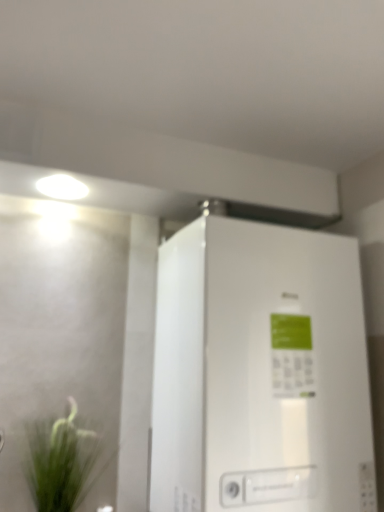
Question: From a real-world perspective, is green grass at lower left physically located above or below white glossy refrigerator at center?

Choices:
 (A) below
 (B) above

Answer: (A)

Question: Looking at the image, does green grass at lower left seem bigger or smaller compared to white glossy refrigerator at center?

Choices:
 (A) small
 (B) big

Answer: (A)

Question: In the image, is green grass at lower left positioned in front of or behind white glossy refrigerator at center?

Choices:
 (A) front
 (B) behind

Answer: (B)

Question: Is point [334, 416] positioned closer to the camera than point [36, 499]?

Choices:
 (A) farther
 (B) closer

Answer: (B)

Question: In the image, is white glossy refrigerator at center positioned in front of or behind green grass at lower left?

Choices:
 (A) behind
 (B) front

Answer: (B)

Question: From a real-world perspective, is white glossy refrigerator at center physically located above or below green grass at lower left?

Choices:
 (A) above
 (B) below

Answer: (A)

Question: Do you think white glossy refrigerator at center is within green grass at lower left, or outside of it?

Choices:
 (A) inside
 (B) outside

Answer: (B)